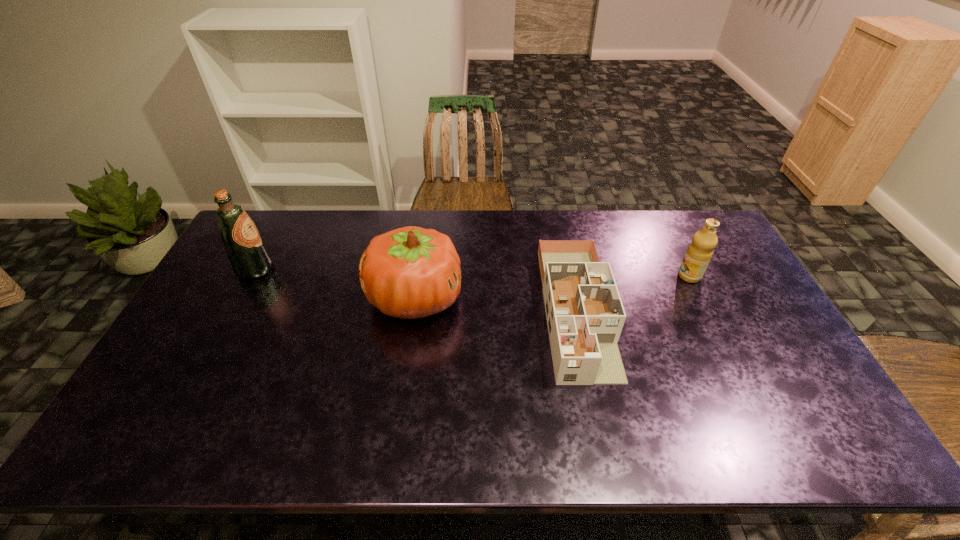
This screenshot has width=960, height=540. Find the location of `empty space between the right olive oil and the second object from right to left`. empty space between the right olive oil and the second object from right to left is located at coordinates (633, 293).

Where is `free spot between the third object from right to left and the shortest object`? The image size is (960, 540). free spot between the third object from right to left and the shortest object is located at coordinates tap(495, 304).

The image size is (960, 540). Find the location of `vacant region between the pumpkin and the left olive oil`. vacant region between the pumpkin and the left olive oil is located at coordinates pos(335,284).

This screenshot has height=540, width=960. I want to click on vacant area that lies between the dollhouse and the shorter olive oil, so click(633, 293).

Locate an element on the screen. Image resolution: width=960 pixels, height=540 pixels. unoccupied position between the shortest object and the second object from left to right is located at coordinates (495, 304).

Image resolution: width=960 pixels, height=540 pixels. I want to click on vacant space that's between the second object from left to right and the leftmost object, so click(335, 284).

Find the location of `free space between the shortest object and the pumpkin`. free space between the shortest object and the pumpkin is located at coordinates (495, 304).

In order to click on vacant region between the third tallest object and the leftmost object in this screenshot , I will do `click(472, 273)`.

Find the location of a particular element. vacant space in between the shortest object and the shorter olive oil is located at coordinates (633, 293).

Choose which object is the nearest neighbor to the third object from left to right. Please provide its 2D coordinates. Your answer should be formatted as a tuple, i.e. [(x, y)], where the tuple contains the x and y coordinates of a point satisfying the conditions above.

[(410, 272)]